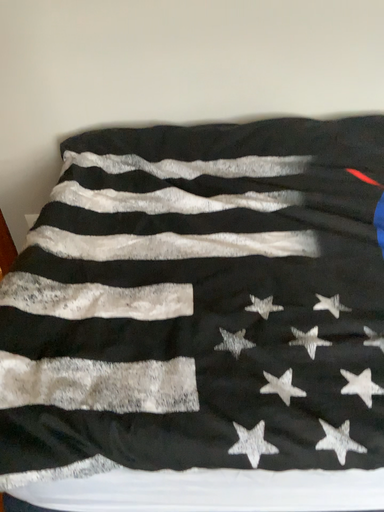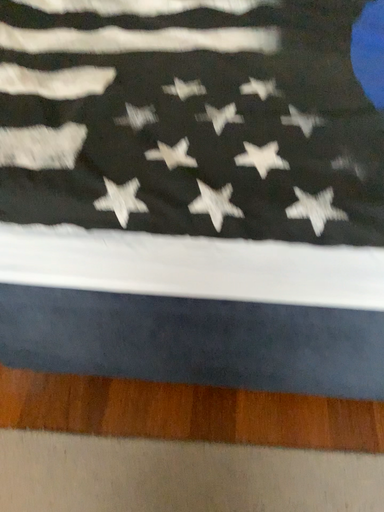
Question: Which way did the camera rotate in the video?

Choices:
 (A) rotated left
 (B) rotated right

Answer: (A)